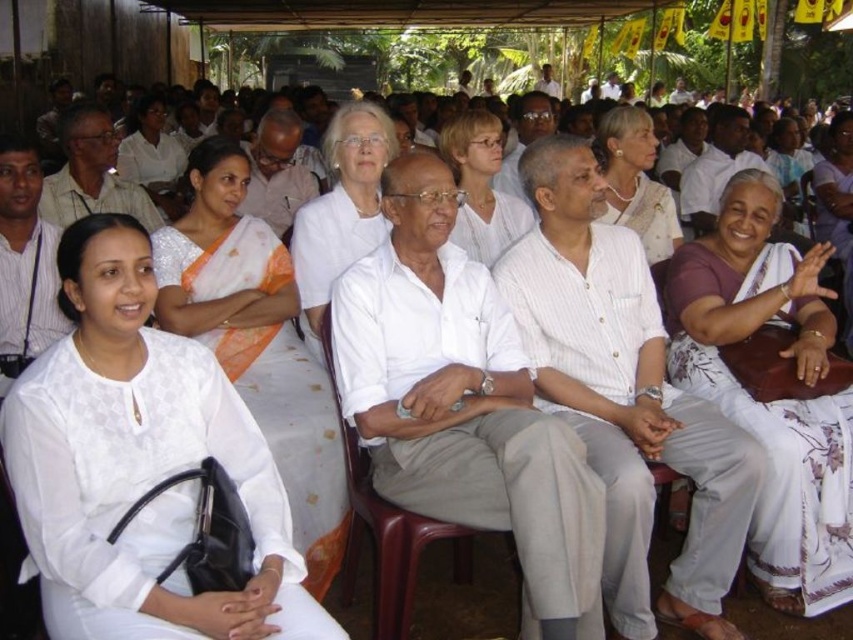
Who is positioned more to the right, white matte blouse at left or purple floral sari at center?

From the viewer's perspective, purple floral sari at center appears more on the right side.

Is point (140, 372) in front of point (759, 428)?

Yes, it is.

This screenshot has height=640, width=853. I want to click on white matte blouse at left, so click(x=138, y=464).

Who is more forward, (730,451) or (357,193)?

Point (730,451) is more forward.

Based on the photo, who is positioned more to the left, white cotton saree at center or white matte/soft fabric at center?

Result: From the viewer's perspective, white matte/soft fabric at center appears more on the left side.

Locate an element on the screen. The image size is (853, 640). white cotton saree at center is located at coordinates (624, 394).

I want to click on purple floral sari at center, so click(x=775, y=401).

Between purple floral sari at center and white matte/soft fabric at center, which one has more height?

purple floral sari at center is taller.

Is point (799, 456) positioned before point (318, 339)?

Yes.

You are a GUI agent. You are given a task and a screenshot of the screen. Output one action in this format:
    pyautogui.click(x=<x>, y=<y>)
    Task: Click on the purple floral sari at center
    The height and width of the screenshot is (640, 853).
    Given the screenshot: What is the action you would take?
    pyautogui.click(x=775, y=401)